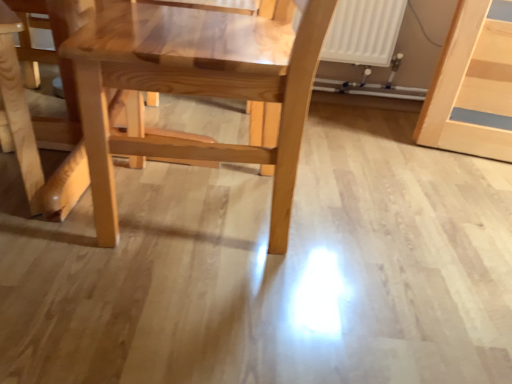
Where is `natural wood chair at center`? This screenshot has height=384, width=512. natural wood chair at center is located at coordinates (195, 88).

What do you see at coordinates (195, 88) in the screenshot?
I see `natural wood chair at center` at bounding box center [195, 88].

Locate an element on the screen. The image size is (512, 384). natural wood chair at center is located at coordinates (195, 88).